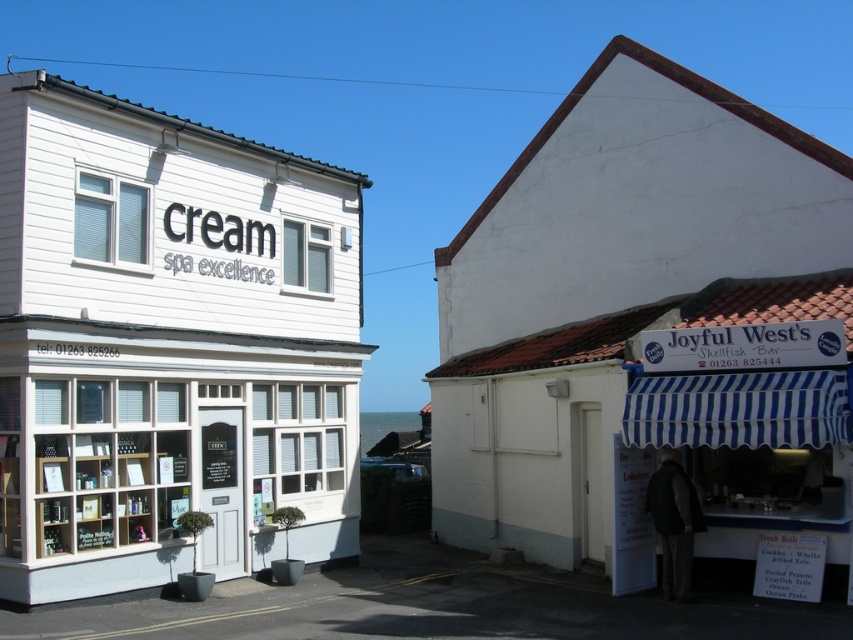
You are standing on the sidewalk between the white wood cream spa excellence at left and the white painted wood shed at right. If you look up, which building appears taller?

The white painted wood shed at right appears taller because it is taller than the white wood cream spa excellence at left.

You are standing on the sidewalk in front of the white wood cream spa excellence at left and the white painted wood shed at right. Which building is closer to you?

The white wood cream spa excellence at left is closer to you because the white painted wood shed at right is behind it.